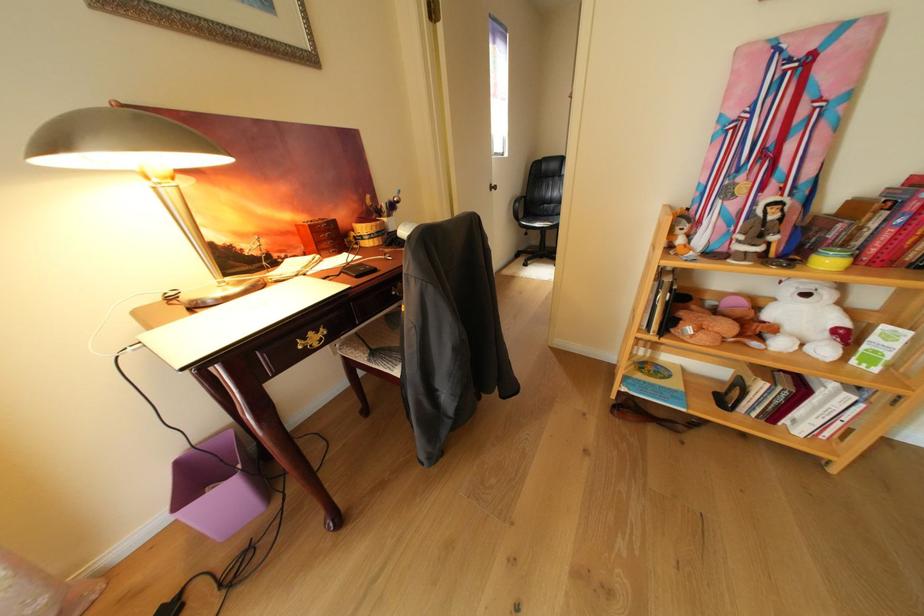
Locate an element on the screen. The width and height of the screenshot is (924, 616). black chair armrest is located at coordinates (518, 205).